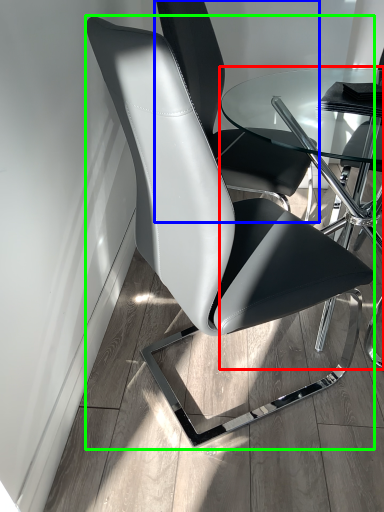
Question: Which object is positioned farthest from table (highlighted by a red box)? Select from chair (highlighted by a blue box) and chair (highlighted by a green box).

Choices:
 (A) chair
 (B) chair

Answer: (B)